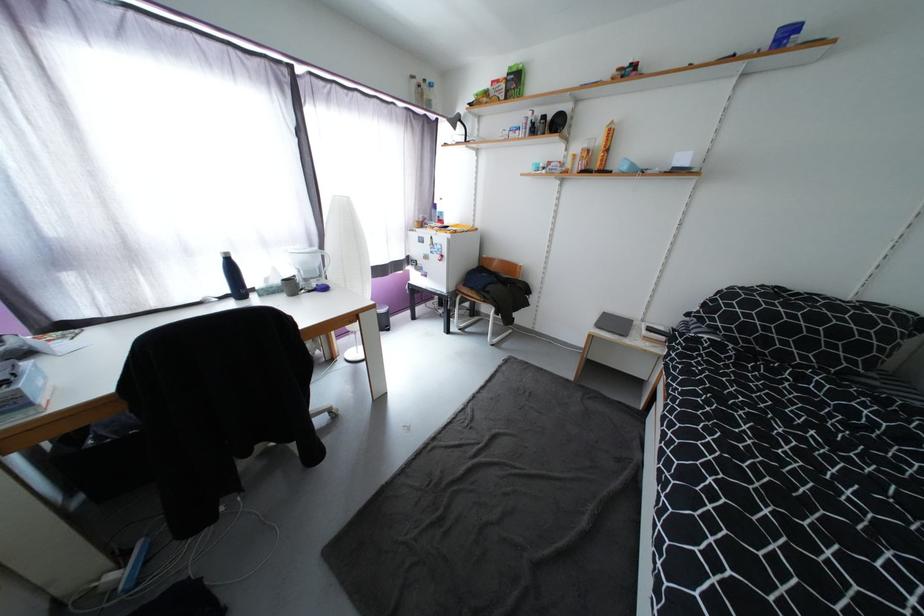
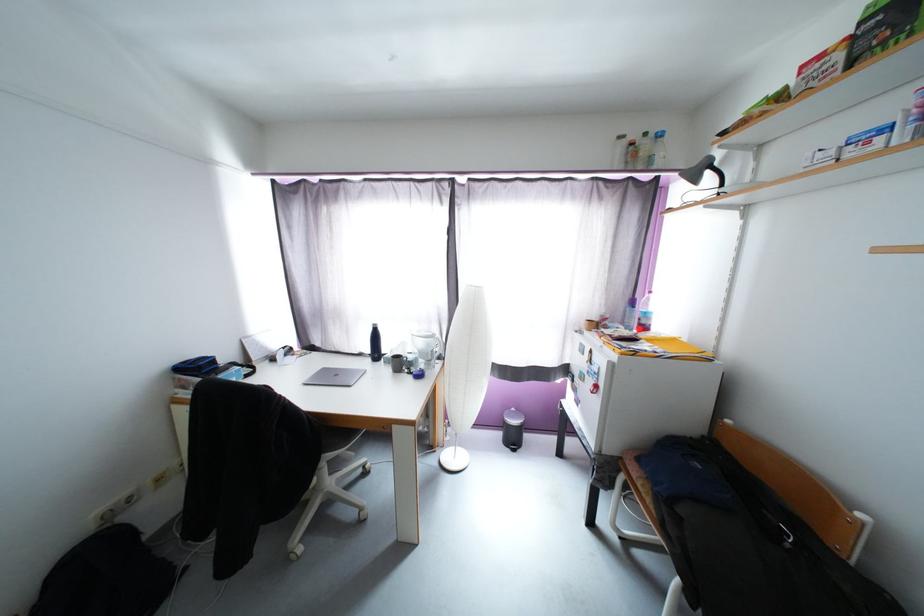
Locate, in the second image, the point that corresponds to (x=424, y=87) in the first image.

(638, 146)